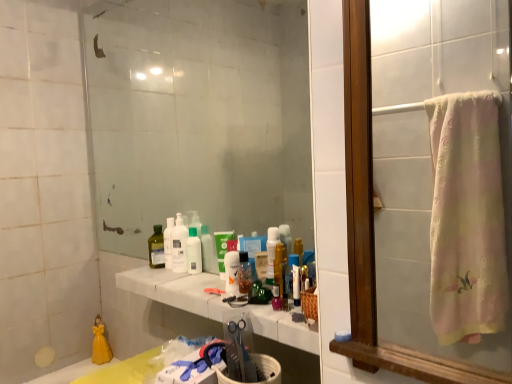
This screenshot has height=384, width=512. What are the coordinates of `free space in front of translucent plastic mouthwash at center, marked as the first mouthwash in a back-to-front arrangement` in the screenshot? It's located at (195, 280).